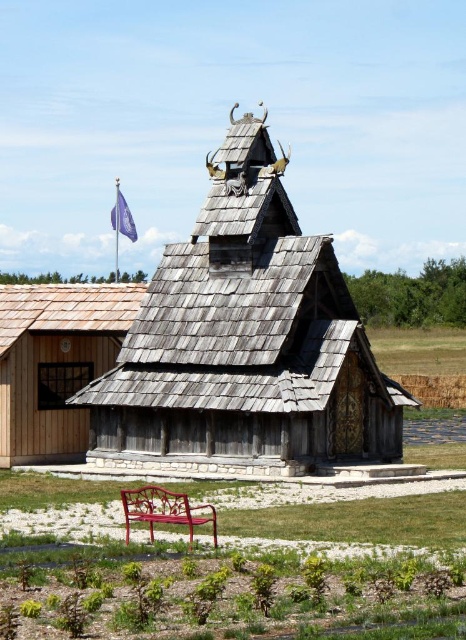
Does weathered wood chapel at center appear on the left side of metallic red bench at center?

Correct, you'll find weathered wood chapel at center to the left of metallic red bench at center.

Describe the element at coordinates (246, 346) in the screenshot. I see `weathered wood chapel at center` at that location.

The height and width of the screenshot is (640, 466). In order to click on weathered wood chapel at center in this screenshot , I will do `click(246, 346)`.